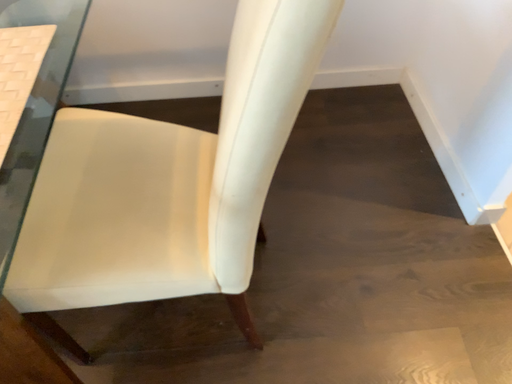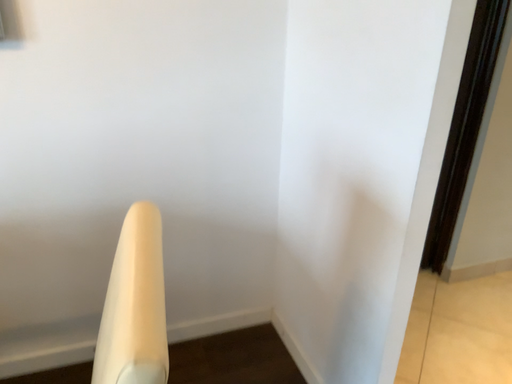
Question: How did the camera likely rotate when shooting the video?

Choices:
 (A) rotated downward
 (B) rotated upward

Answer: (B)